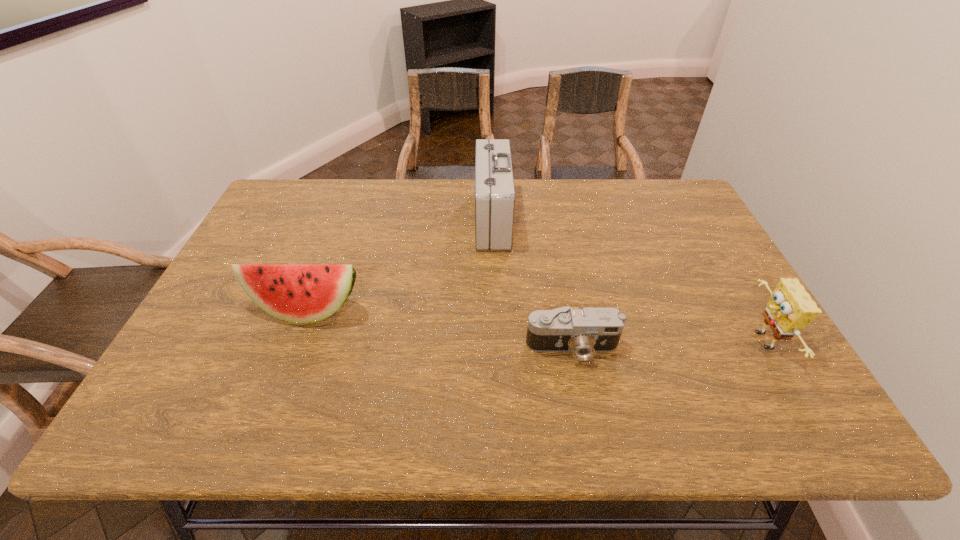
You are a GUI agent. You are given a task and a screenshot of the screen. Output one action in this format:
    pyautogui.click(x=<x>, y=<y>)
    Task: Click on the free space at the near right corner of the desktop
    The width and height of the screenshot is (960, 540).
    Given the screenshot: What is the action you would take?
    pyautogui.click(x=761, y=429)

This screenshot has width=960, height=540. In order to click on unoccupied area between the shortest object and the leftmost object in this screenshot , I will do `click(440, 328)`.

Find the location of a particular element. This screenshot has width=960, height=540. vacant area that lies between the watermelon and the farthest object is located at coordinates (399, 264).

The image size is (960, 540). In order to click on empty location between the camera and the watermelon in this screenshot , I will do `click(440, 328)`.

The image size is (960, 540). I want to click on free space between the second object from left to right and the camera, so click(533, 283).

Where is `free point between the second object from left to right and the camera`? Image resolution: width=960 pixels, height=540 pixels. free point between the second object from left to right and the camera is located at coordinates (533, 283).

This screenshot has height=540, width=960. What are the coordinates of `free point between the second object from right to left and the sponge` in the screenshot? It's located at point(667,345).

What are the coordinates of `free space between the first-aid kit and the sponge` in the screenshot? It's located at (627, 280).

Identify the location of empty space between the camera and the watermelon. The image size is (960, 540). (440, 328).

Identify which object is the third closest to the first-aid kit. Please provide its 2D coordinates. Your answer should be formatted as a tuple, i.e. [(x, y)], where the tuple contains the x and y coordinates of a point satisfying the conditions above.

[(790, 308)]